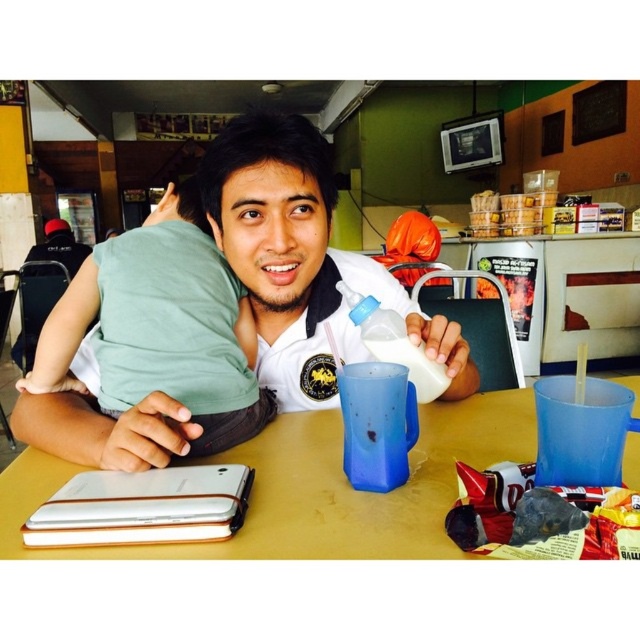
You are a customer in a cafe and want to find the green cotton shirt at left. According to the scene description, where would you look to find it?

The green cotton shirt at left is located at the coordinates point (x=156, y=326).

You are a photographer standing at the camera position. You want to take a closeup photo of the point at coordinate (264, 412). The camera can focus on objects within 30 inches. Will the point be in focus?

The point at coordinate (264, 412) is 31.91 inches from the camera, which is beyond the 30 inches focus range. Therefore, the point will not be in focus.

You are a photographer taking a picture of the scene. You need to adjust the lighting so that the white plastic bottle at center is more visible without overexposing the white matte shirt at center. Which object should you focus on adjusting the exposure for?

The white matte shirt at center is located above the white plastic bottle at center. To avoid overexposing the shirt, you should adjust the exposure for the white plastic bottle at center first, ensuring it is properly lit without making the shirt too bright.